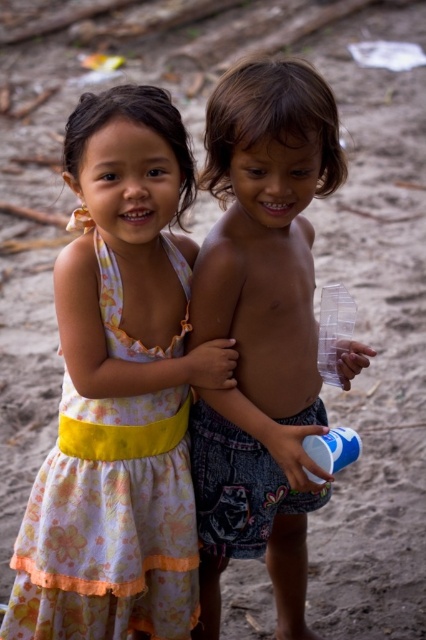
Question: Estimate the real-world distances between objects in this image. Which object is closer to the shiny plastic cup at center?

Choices:
 (A) floral cotton dress at center
 (B) floral cotton dress at left

Answer: (A)

Question: Is shiny plastic cup at center above floral cotton dress at left?

Choices:
 (A) no
 (B) yes

Answer: (B)

Question: Which object is positioned closest to the floral cotton dress at center?

Choices:
 (A) shiny plastic cup at center
 (B) floral cotton dress at left

Answer: (B)

Question: Does shiny plastic cup at center appear under floral cotton dress at left?

Choices:
 (A) no
 (B) yes

Answer: (A)

Question: Which point appears farthest from the camera in this image?

Choices:
 (A) (63, 408)
 (B) (40, 536)
 (C) (278, 70)

Answer: (A)

Question: Is the position of shiny plastic cup at center less distant than that of floral cotton dress at left?

Choices:
 (A) yes
 (B) no

Answer: (A)